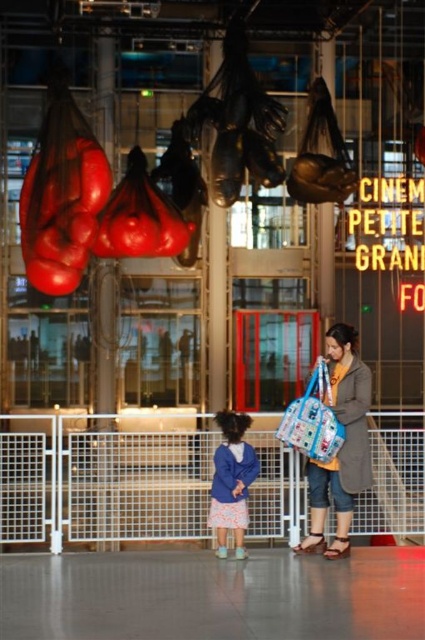
Question: Does white metal fence at lower center come behind blue fleece jacket at center?

Choices:
 (A) yes
 (B) no

Answer: (A)

Question: Which object is closer to the camera taking this photo?

Choices:
 (A) blue fleece jacket at center
 (B) blue fabric bag at center
 (C) matte gray coat at center
 (D) white metal fence at lower center

Answer: (B)

Question: Among these points, which one is farthest from the camera?

Choices:
 (A) (314, 493)
 (B) (255, 499)
 (C) (218, 456)

Answer: (B)

Question: Is matte gray coat at center above blue fleece jacket at center?

Choices:
 (A) yes
 (B) no

Answer: (A)

Question: Can you confirm if matte gray coat at center is positioned to the left of blue fleece jacket at center?

Choices:
 (A) yes
 (B) no

Answer: (B)

Question: Which of the following is the closest to the observer?

Choices:
 (A) blue fleece jacket at center
 (B) matte gray coat at center
 (C) white metal fence at lower center
 (D) blue fabric bag at center

Answer: (D)